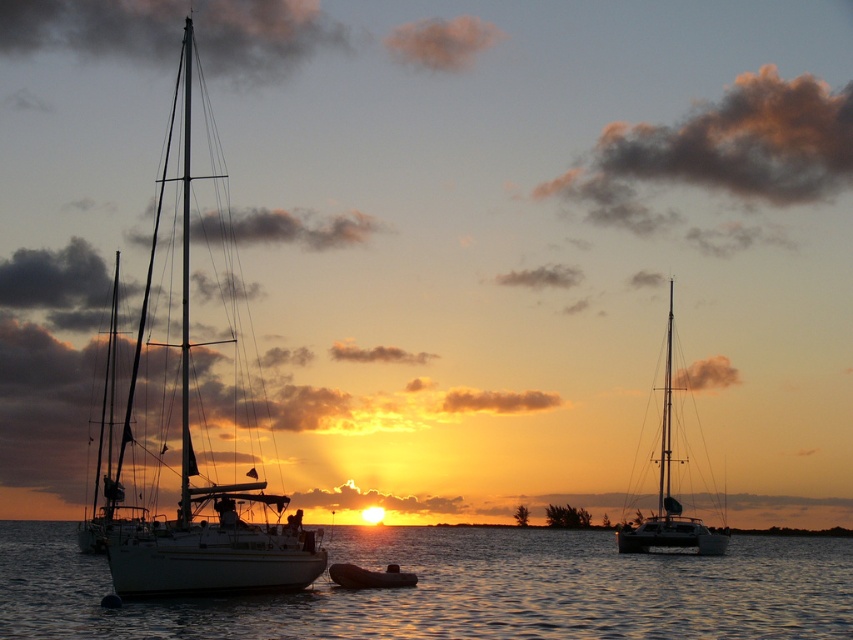
You are a photographer positioned at the shore, aiming to capture both the white matte sailboat at left and the rubber dinghy at center in your shot. Given that your camera has a fixed focal length and you can only adjust your position, which boat should you move closer to in order to include both in the frame without cropping either?

To include both the white matte sailboat at left and the rubber dinghy at center in the frame without cropping, you should move closer to the rubber dinghy at center. Since the white matte sailboat at left might be wider than the rubber dinghy at center, moving closer to the smaller boat allows you to balance their sizes in the composition so both fit within the camera frame.

You are a photographer positioned on the shore, aiming to capture both the white matte sailboat at left and the silvery metallic sailboat at center in your shot. Based on their positions, which boat will appear larger in your photo?

The white matte sailboat at left appears larger in the photo because it is closer to the viewer than the silvery metallic sailboat at center.

You are a photographer planning to capture the sunset scene. You want to ensure both the white matte sailboat at left and the silvery metallic sailboat at center are fully visible in your shot. Based on their widths, which boat might require you to adjust your camera angle to avoid cropping?

The white matte sailboat at left might be wider than the silvery metallic sailboat at center, so you might need to adjust your camera angle to ensure the wider white matte sailboat at left fits without cropping.